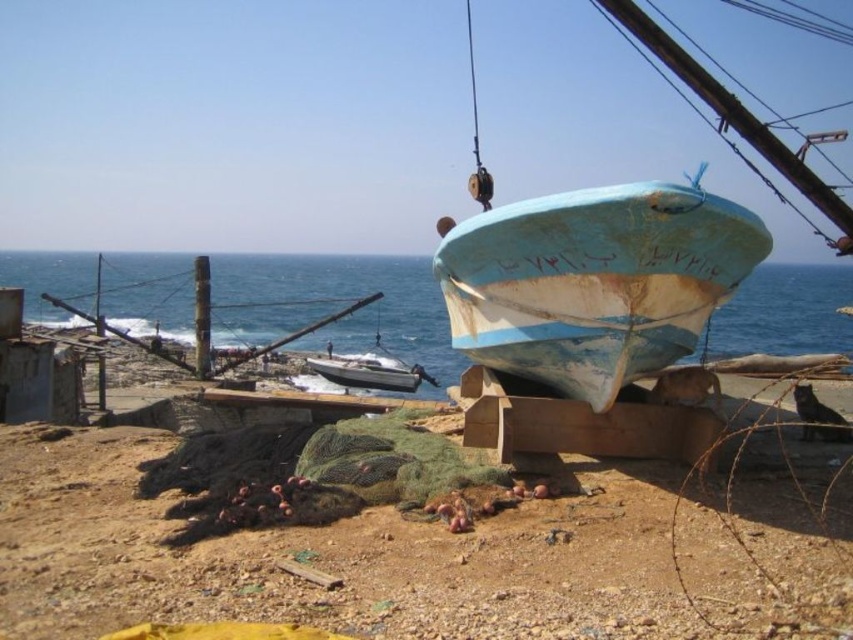
You are a dock worker inspecting the boats at the center of the dock. You need to secure the rusty blue boat at center to the wooden platform. Which side of the blue painted wood boat at center should you anchor it to?

The rusty blue boat at center is positioned on the right side of the blue painted wood boat at center, so you should anchor it to the left side of the blue painted wood boat at center to secure it properly.